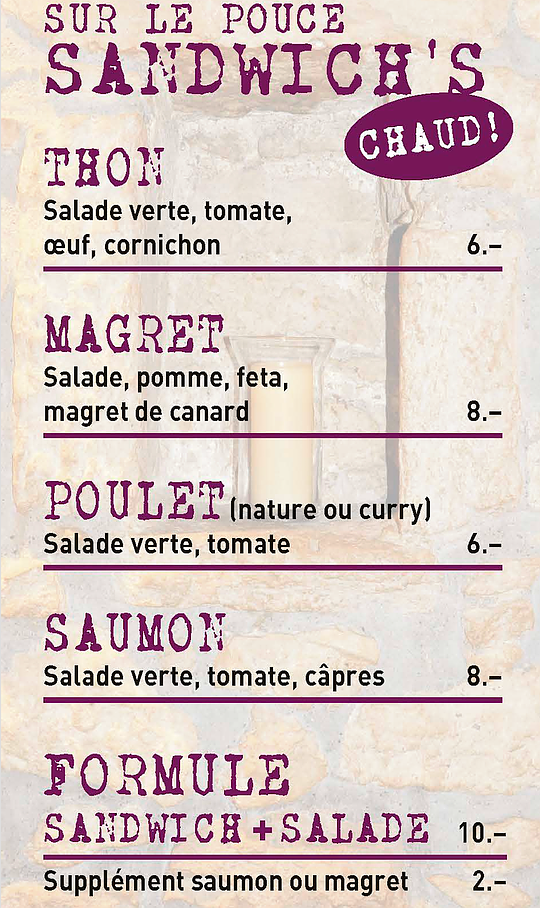
This screenshot has height=908, width=540. I want to click on cream colored candle, so click(288, 417).